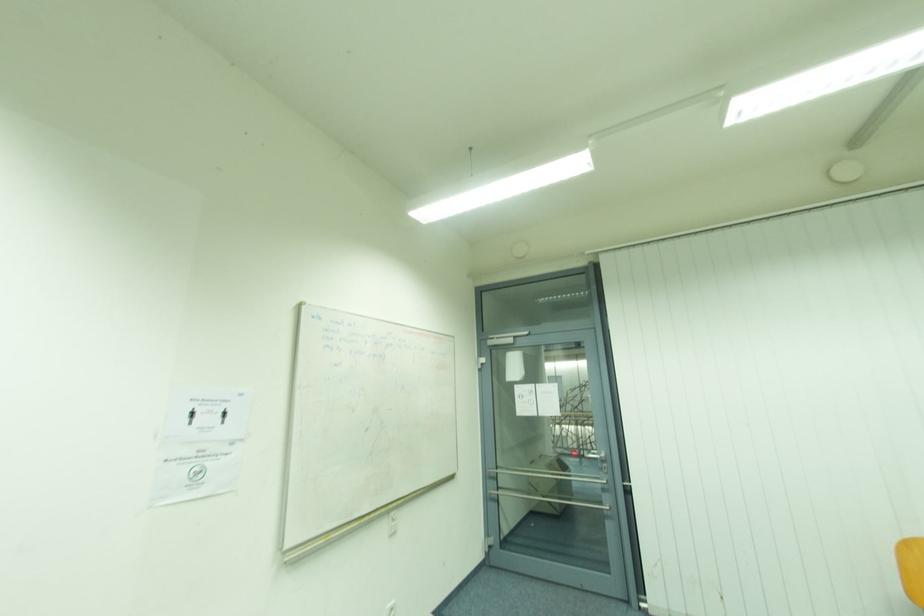
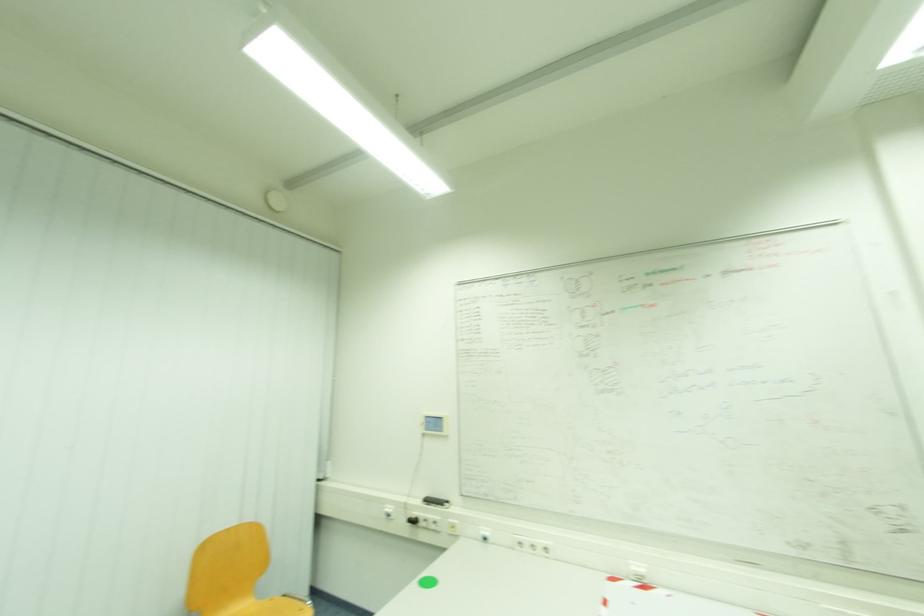
Question: The camera is either moving clockwise (left) or counter-clockwise (right) around the object. The first image is from the beginning of the video and the second image is from the end. Is the camera moving left or right when shooting the video?

Choices:
 (A) Left
 (B) Right

Answer: (A)